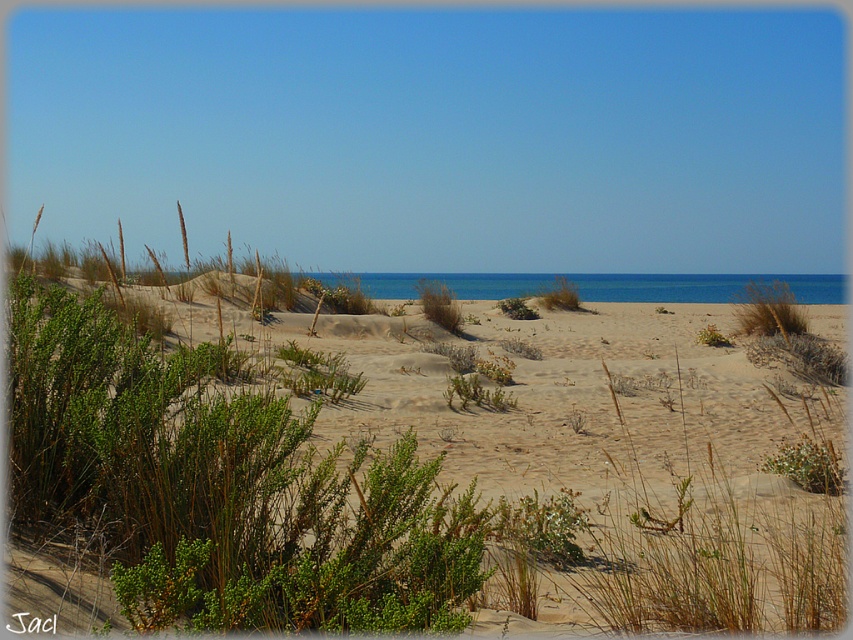
Question: Which object appears closest to the camera in this image?

Choices:
 (A) green leafy bush at center
 (B) green shrubs at center

Answer: (B)

Question: Does green shrubs at center have a larger size compared to green grass at center?

Choices:
 (A) yes
 (B) no

Answer: (A)

Question: Which object appears closest to the camera in this image?

Choices:
 (A) green leafy bush at center
 (B) green shrubs at center

Answer: (B)

Question: Is green grass at center bigger than green leafy bush at center?

Choices:
 (A) yes
 (B) no

Answer: (A)

Question: Can you confirm if green grass at center is smaller than green leafy bush at center?

Choices:
 (A) no
 (B) yes

Answer: (A)

Question: Among these points, which one is farthest from the camera?

Choices:
 (A) [x=408, y=376]
 (B) [x=434, y=284]

Answer: (B)